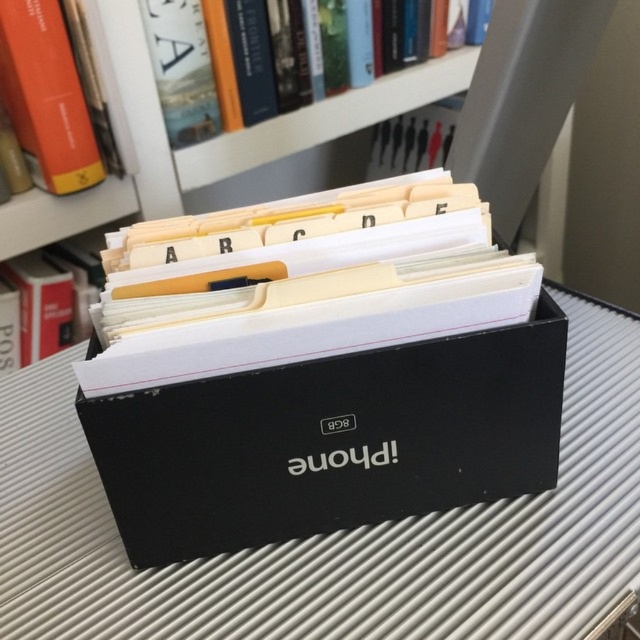
Question: Considering the relative positions of black matte box at center and orange hardcover book at upper left in the image provided, where is black matte box at center located with respect to orange hardcover book at upper left?

Choices:
 (A) below
 (B) above

Answer: (A)

Question: Which of the following is the closest to the observer?

Choices:
 (A) (358, 65)
 (B) (60, 134)
 (C) (56, 426)

Answer: (C)

Question: Which object is farther from the camera taking this photo?

Choices:
 (A) hardcover book at upper center
 (B) orange hardcover book at upper left

Answer: (A)

Question: Can you confirm if black matte box at center is positioned to the left of hardcover book at upper center?

Choices:
 (A) yes
 (B) no

Answer: (A)

Question: Based on their relative distances, which object is farther from the orange hardcover book at upper left?

Choices:
 (A) black matte box at center
 (B) hardcover book at upper center

Answer: (A)

Question: Is black matte box at center to the right of hardcover book at upper center from the viewer's perspective?

Choices:
 (A) no
 (B) yes

Answer: (A)